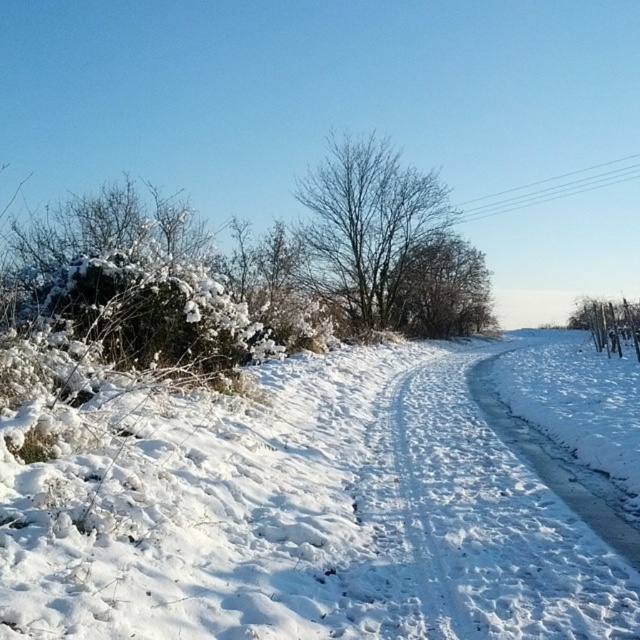
Which of these two, white fluffy snow at center or bare branches at center, stands taller?

bare branches at center is taller.

Between point (365, 417) and point (328, 241), which one is positioned in front?

Point (365, 417) is more forward.

Is point (307, 598) in front of point (406, 202)?

That is True.

Find the location of `white fluffy snow at center`. white fluffy snow at center is located at coordinates (308, 518).

Looking at this image, can you confirm if white snow at center is wider than bare branches at center?

In fact, white snow at center might be narrower than bare branches at center.

Is white snow at center shorter than bare branches at center?

Correct, white snow at center is not as tall as bare branches at center.

The image size is (640, 640). Find the location of `white snow at center`. white snow at center is located at coordinates (474, 525).

Does white fluffy snow at center come in front of white snow at center?

That is True.

Does white fluffy snow at center appear under white snow at center?

Incorrect, white fluffy snow at center is not positioned below white snow at center.

This screenshot has height=640, width=640. What are the coordinates of `white fluffy snow at center` in the screenshot? It's located at click(x=308, y=518).

In order to click on white fluffy snow at center in this screenshot , I will do tap(308, 518).